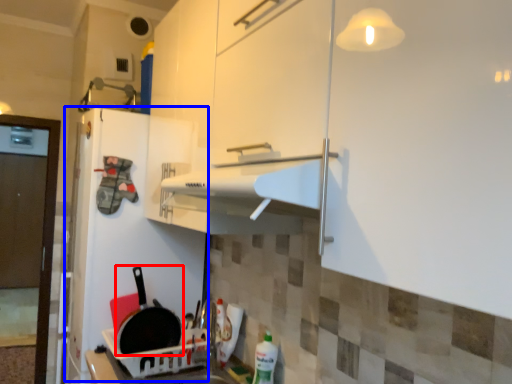
Question: Among these objects, which one is farthest to the camera, frying pan (highlighted by a red box) or fridge (highlighted by a blue box)?

Choices:
 (A) frying pan
 (B) fridge

Answer: (B)